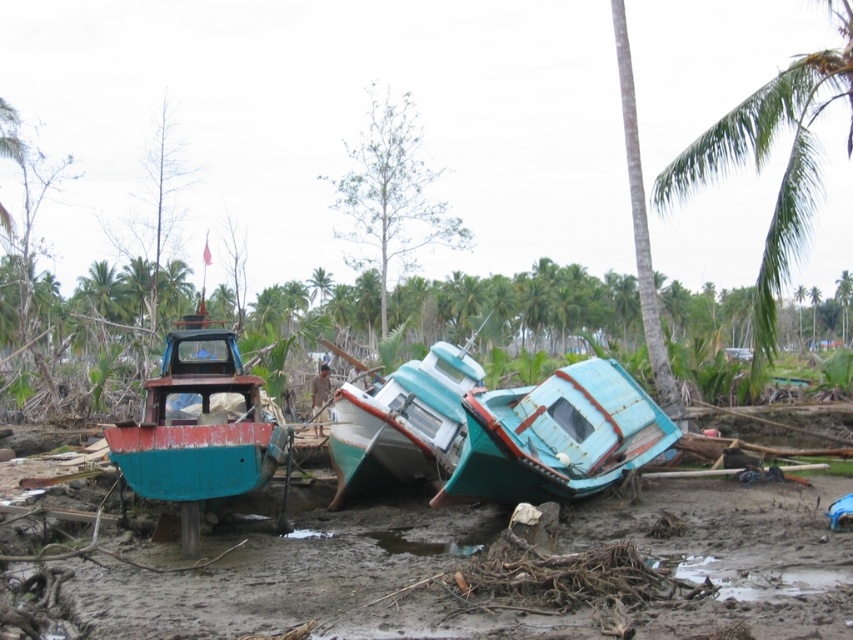
You are a rescue worker trying to reach the green leafy palm tree at upper right to set up a signal flag. The rusty metal boat at left is blocking your path. Can you walk around it to reach the palm tree?

The rusty metal boat at left is in front of the green leafy palm tree at upper right, so you can walk around the boat to reach the palm tree as it is blocking the direct path but not the entire area.

You are a rescue worker trying to assess the distance between two palm trees in the disaster area. The scene shows a coastal area with three damaged boats and scattered debris. You need to determine if a helicopter can land safely between the green leafy palm tree at upper right and the green leafy palm tree at upper center. The helicopter requires a minimum of 50 meters of clear space. Can the helicopter land there?

The green leafy palm tree at upper right is 54.37 meters from the green leafy palm tree at upper center. Since the required minimum distance for the helicopter is 50 meters, the 54.37 meters between them provides sufficient space for safe landing.

In the scene shown: You are a rescue worker assessing the damage in the coastal area. You notice the rusty metal boat at left and the green leafy palm tree at upper right. Which object is shorter in height?

The rusty metal boat at left has a lesser height compared to the green leafy palm tree at upper right, so the rusty metal boat at left is shorter in height.